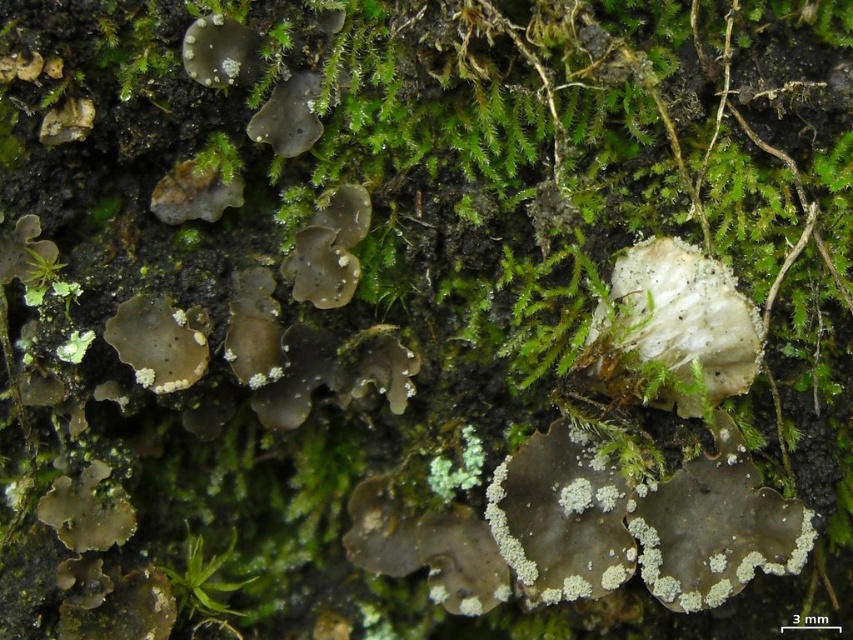
You are a botanist examining the natural surface. You need to locate the white crustose lichen at center and the brown matte rock at upper left. Based on their positions, which object is closer to the right edge of the surface?

The white crustose lichen at center is to the right of brown matte rock at upper left, so the white crustose lichen at center is closer to the right edge of the surface.

You are a researcher holding a magnifying glass 1 meter away from your eyes. You want to examine the white crustose lichen at center closely. Is the lichen within your magnifying glass range?

The white crustose lichen at center is 1.32 meters away from the viewer. Since the magnifying glass is held 1 meter away from your eyes, the lichen is 0.32 meters beyond the magnifying glass range, so it cannot be examined closely with it.

You are a researcher studying lichen distribution. You have a grid map of the area with coordinates from 0 to 1. You see the white crustose lichen at center. What are its coordinates on the grid map?

The white crustose lichen at center is located at coordinates point (560,518).